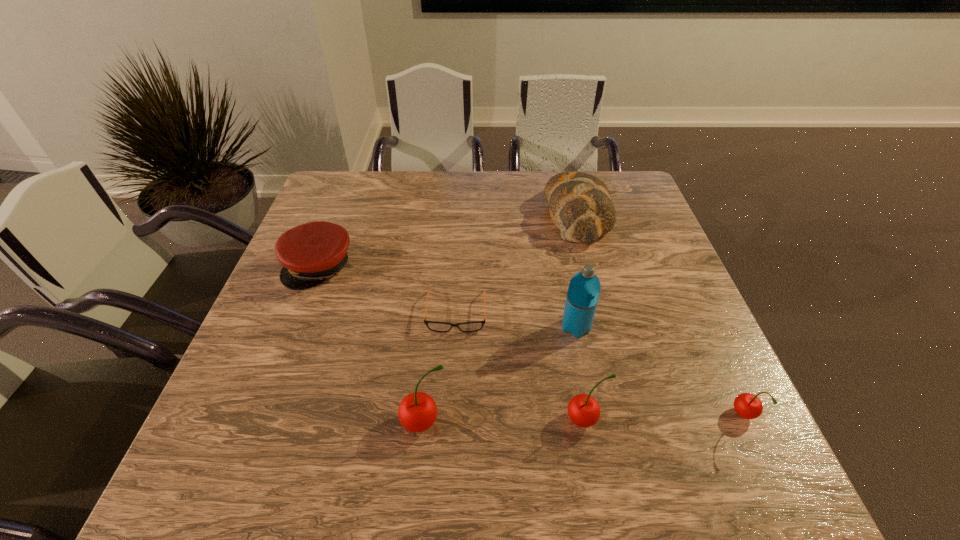
Please point a vacant point for placing a cherry on the left. Please provide its 2D coordinates. Your answer should be formatted as a tuple, i.e. [(x, y)], where the tuple contains the x and y coordinates of a point satisfying the conditions above.

[(261, 426)]